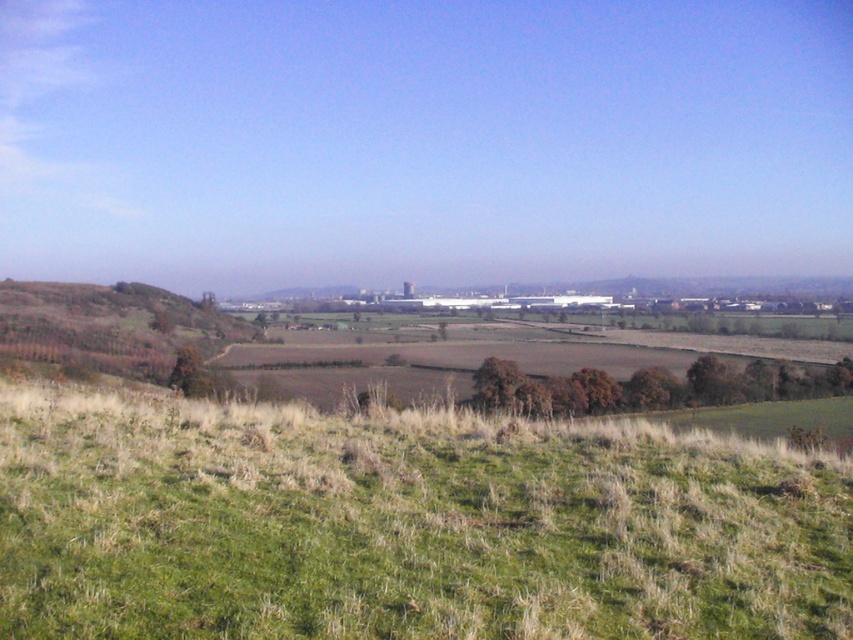
Question: Which point appears closest to the camera in this image?

Choices:
 (A) (3, 294)
 (B) (432, 582)

Answer: (B)

Question: Can you confirm if green grassy hillside at lower center is thinner than brown grassy hillside at left?

Choices:
 (A) yes
 (B) no

Answer: (A)

Question: Which object is farther from the camera taking this photo?

Choices:
 (A) brown grassy hillside at left
 (B) green grassy hillside at lower center

Answer: (A)

Question: Where is green grassy hillside at lower center located in relation to brown grassy hillside at left in the image?

Choices:
 (A) right
 (B) left

Answer: (A)

Question: Which point is closer to the camera taking this photo?

Choices:
 (A) (645, 608)
 (B) (165, 310)

Answer: (A)

Question: Is green grassy hillside at lower center to the right of brown grassy hillside at left from the viewer's perspective?

Choices:
 (A) no
 (B) yes

Answer: (B)